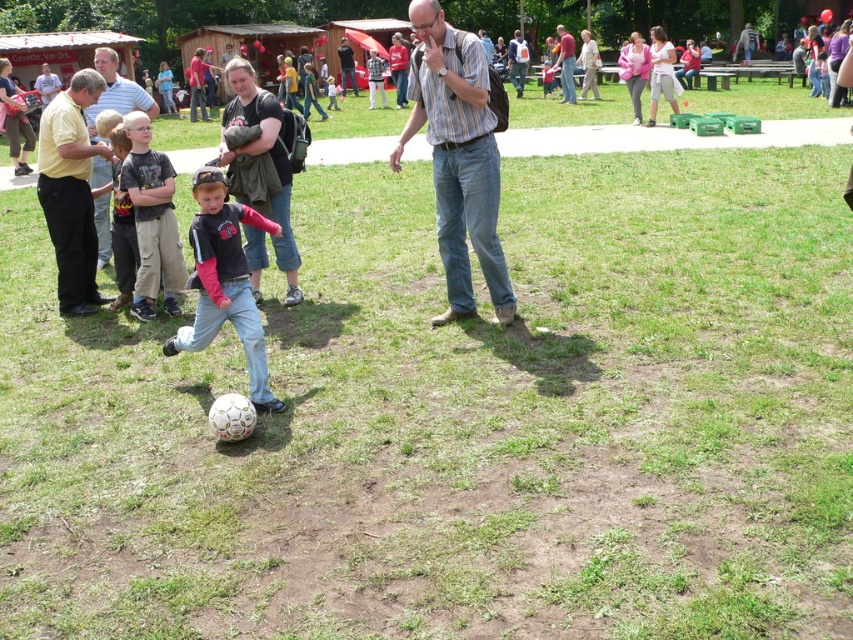
You are standing at the point labeled as point (457, 157) in the image. What object is located at this point?

The point (457, 157) indicates the location of the striped cotton shirt at center.

You are a photographer standing at the camera position. You want to capture a closeup shot of the striped cotton shirt at center. Given that your camera can focus on objects within 10 feet, will you be able to take the closeup?

The striped cotton shirt at center is 21.68 feet away from the camera, which is beyond the 10 feet focusing range. Therefore, you won the closeup shot.

From the picture: What is the 2D coordinate of the dark gray cotton shirt at center?

The dark gray cotton shirt at center is located at the 2D coordinate point of (151, 220).